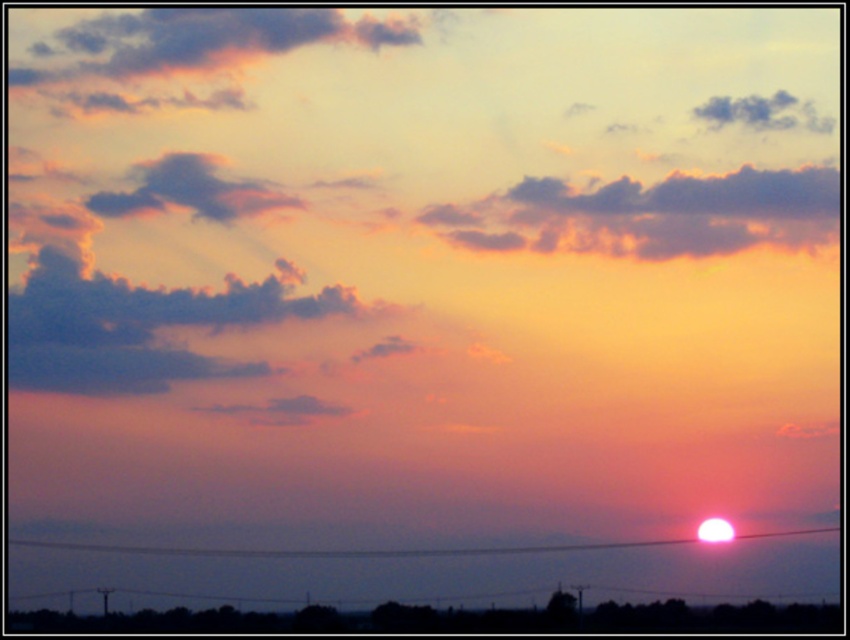
Consider the image. Between bright red wire at lower center and dark gray cloud at upper right, which one is positioned higher?

dark gray cloud at upper right is higher up.

Is the position of bright red wire at lower center less distant than that of dark gray cloud at upper right?

Yes, bright red wire at lower center is closer to the viewer.

Is point (8, 540) in front of point (738, 104)?

Yes, it is in front of point (738, 104).

Where is `bright red wire at lower center`? The image size is (850, 640). bright red wire at lower center is located at coordinates (415, 548).

Which is more to the left, cloudy textured cloud at upper left or bright red wire at lower center?

cloudy textured cloud at upper left is more to the left.

What do you see at coordinates (190, 189) in the screenshot? The height and width of the screenshot is (640, 850). I see `cloudy textured cloud at upper left` at bounding box center [190, 189].

Is point (227, 189) positioned after point (717, 538)?

Yes, point (227, 189) is farther from viewer.

Identify the location of cloudy textured cloud at upper left. (190, 189).

Can you confirm if cloudy textured clouds at upper center is wider than bright red wire at lower center?

Incorrect, cloudy textured clouds at upper center's width does not surpass bright red wire at lower center's.

Between cloudy textured clouds at upper center and bright red wire at lower center, which one is positioned higher?

cloudy textured clouds at upper center

Does point (707, 221) come closer to viewer compared to point (190, 547)?

No, (707, 221) is further to viewer.

Where is `cloudy textured clouds at upper center`? This screenshot has height=640, width=850. cloudy textured clouds at upper center is located at coordinates (649, 214).